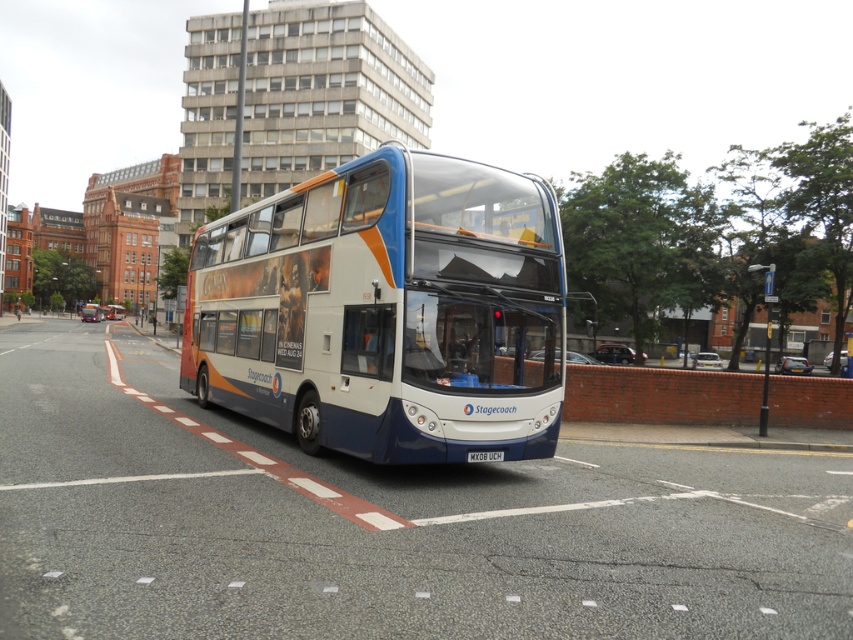
Is white glossy decker bus at center below white glossy bus at center?

Correct, white glossy decker bus at center is located below white glossy bus at center.

Is point (352, 193) positioned in front of point (115, 316)?

Yes, point (352, 193) is closer to viewer.

Does point (329, 355) lie behind point (105, 314)?

That is False.

You are a GUI agent. You are given a task and a screenshot of the screen. Output one action in this format:
    pyautogui.click(x=<x>, y=<y>)
    Task: Click on the white glossy decker bus at center
    
    Given the screenshot: What is the action you would take?
    pyautogui.click(x=386, y=310)

Looking at this image, which is below, white plastic license plate at center or white glossy bus at center?

white plastic license plate at center is lower down.

This screenshot has height=640, width=853. Identify the location of white plastic license plate at center. (485, 456).

Where is `white plastic license plate at center`? white plastic license plate at center is located at coordinates (485, 456).

Is white glossy decker bus at center below white plastic license plate at center?

Actually, white glossy decker bus at center is above white plastic license plate at center.

Between point (520, 371) and point (500, 449), which one is positioned in front?

Positioned in front is point (500, 449).

I want to click on white glossy decker bus at center, so coord(386,310).